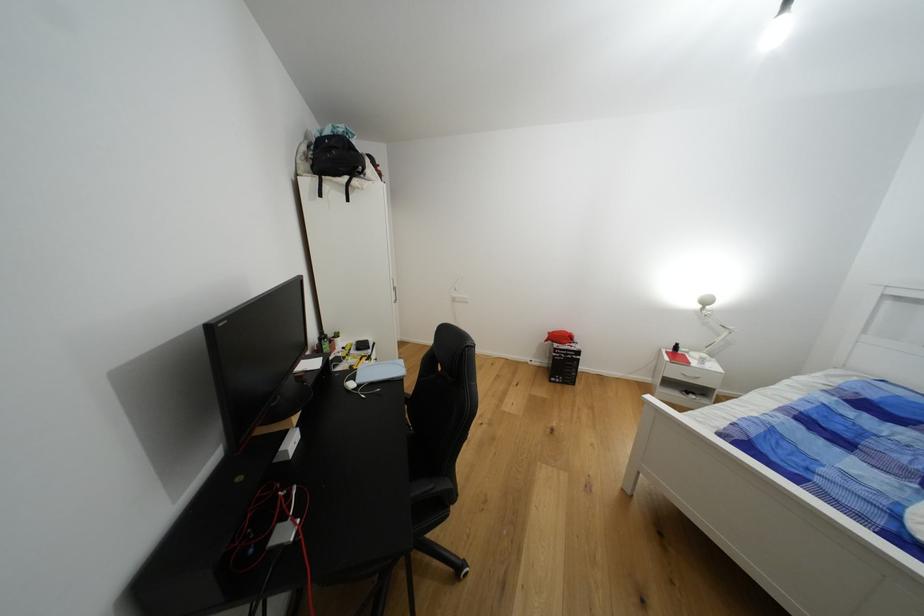
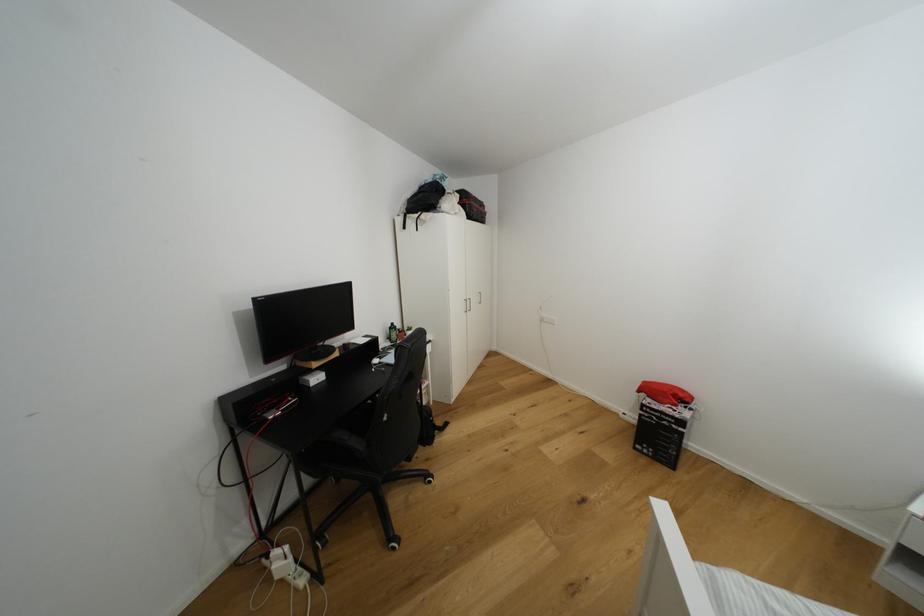
Question: The first image is from the beginning of the video and the second image is from the end. How did the camera likely rotate when shooting the video?

Choices:
 (A) Left
 (B) Right
 (C) Up
 (D) Down

Answer: (A)